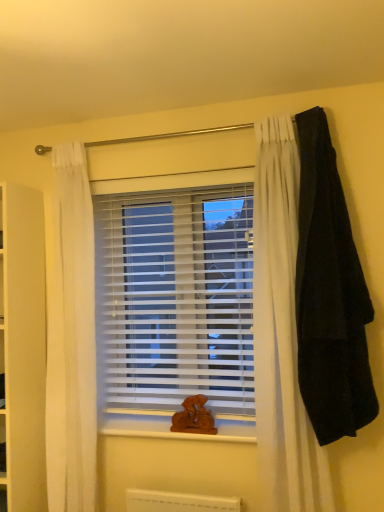
Question: Is black woolen blanket at right at the right side of white plastic blinds at center?

Choices:
 (A) no
 (B) yes

Answer: (B)

Question: Does black woolen blanket at right appear on the left side of white plastic blinds at center?

Choices:
 (A) yes
 (B) no

Answer: (B)

Question: Can we say black woolen blanket at right lies outside white plastic blinds at center?

Choices:
 (A) yes
 (B) no

Answer: (A)

Question: Does black woolen blanket at right have a greater height compared to white plastic blinds at center?

Choices:
 (A) yes
 (B) no

Answer: (A)

Question: Does black woolen blanket at right lie behind white plastic blinds at center?

Choices:
 (A) no
 (B) yes

Answer: (A)

Question: From the image's perspective, is black woolen blanket at right located beneath white plastic blinds at center?

Choices:
 (A) no
 (B) yes

Answer: (A)

Question: Considering the relative positions of black woolen blanket at right and wooden at center in the image provided, is black woolen blanket at right to the right of wooden at center from the viewer's perspective?

Choices:
 (A) no
 (B) yes

Answer: (B)

Question: Does black woolen blanket at right have a greater width compared to wooden at center?

Choices:
 (A) yes
 (B) no

Answer: (B)

Question: From a real-world perspective, is black woolen blanket at right over wooden at center?

Choices:
 (A) yes
 (B) no

Answer: (A)

Question: Does black woolen blanket at right have a smaller size compared to wooden at center?

Choices:
 (A) no
 (B) yes

Answer: (A)

Question: Is black woolen blanket at right positioned beyond the bounds of wooden at center?

Choices:
 (A) yes
 (B) no

Answer: (A)

Question: Does black woolen blanket at right have a greater height compared to wooden at center?

Choices:
 (A) no
 (B) yes

Answer: (B)

Question: Considering the relative sizes of wooden at center and white plastic blinds at center in the image provided, is wooden at center wider than white plastic blinds at center?

Choices:
 (A) no
 (B) yes

Answer: (B)